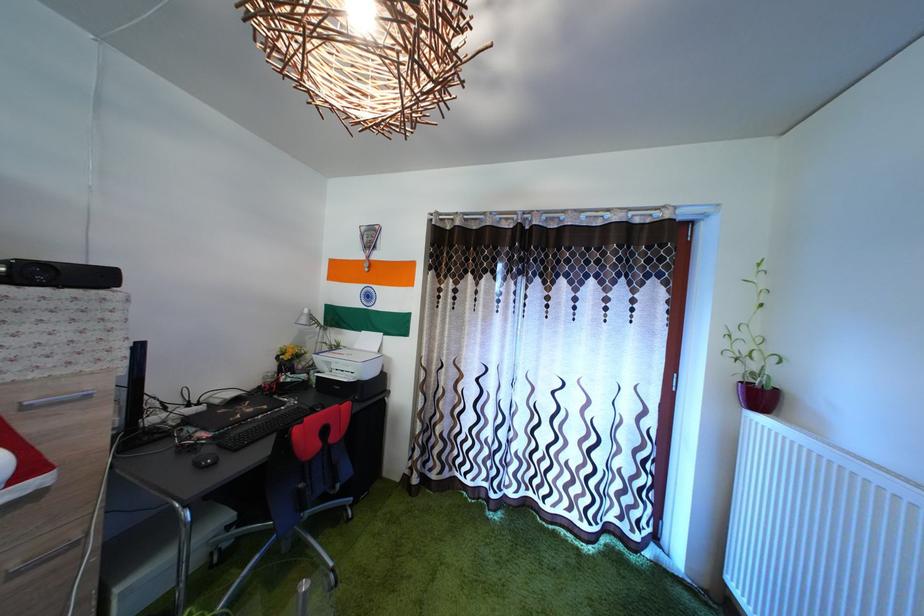
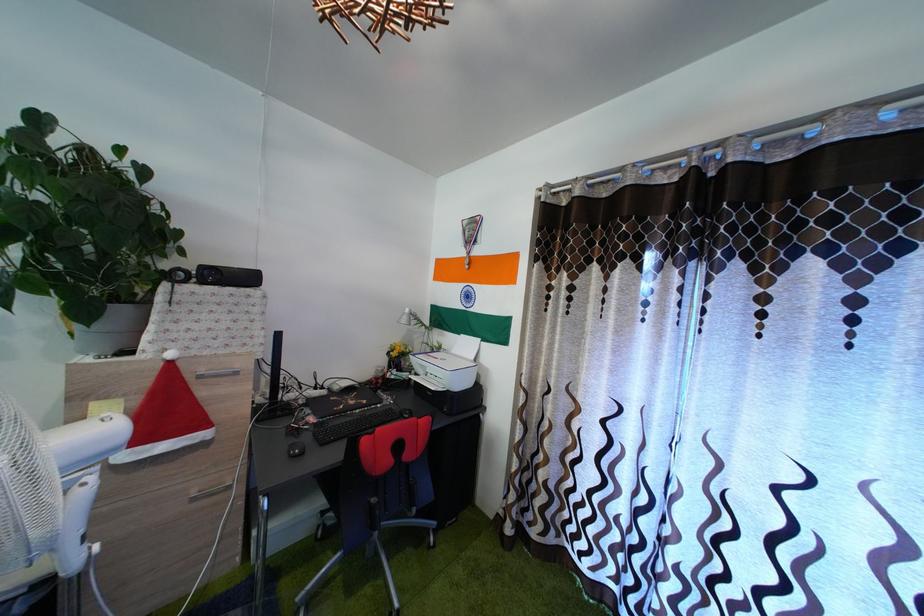
Question: The camera is either moving clockwise (left) or counter-clockwise (right) around the object. The first image is from the beginning of the video and the second image is from the end. Is the camera moving left or right when shooting the video?

Choices:
 (A) Left
 (B) Right

Answer: (B)